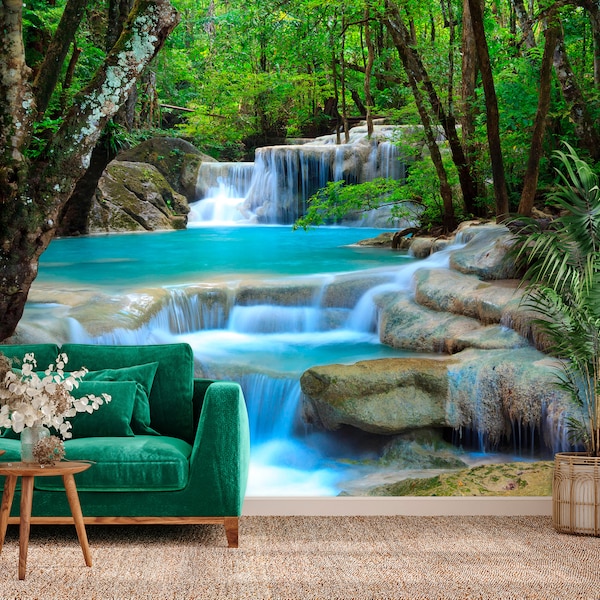
Where is `baseboard`? baseboard is located at coordinates (365, 503).